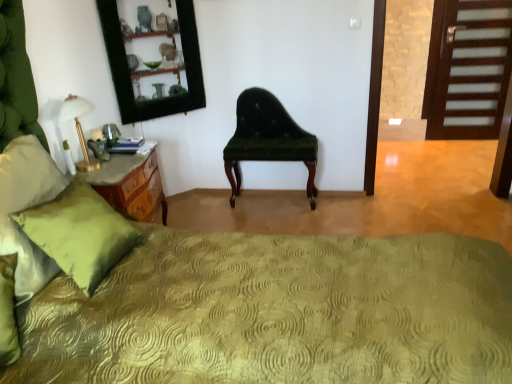
The width and height of the screenshot is (512, 384). Find the location of `vacant space that is to the left of dark wood door at right`. vacant space that is to the left of dark wood door at right is located at coordinates click(x=435, y=148).